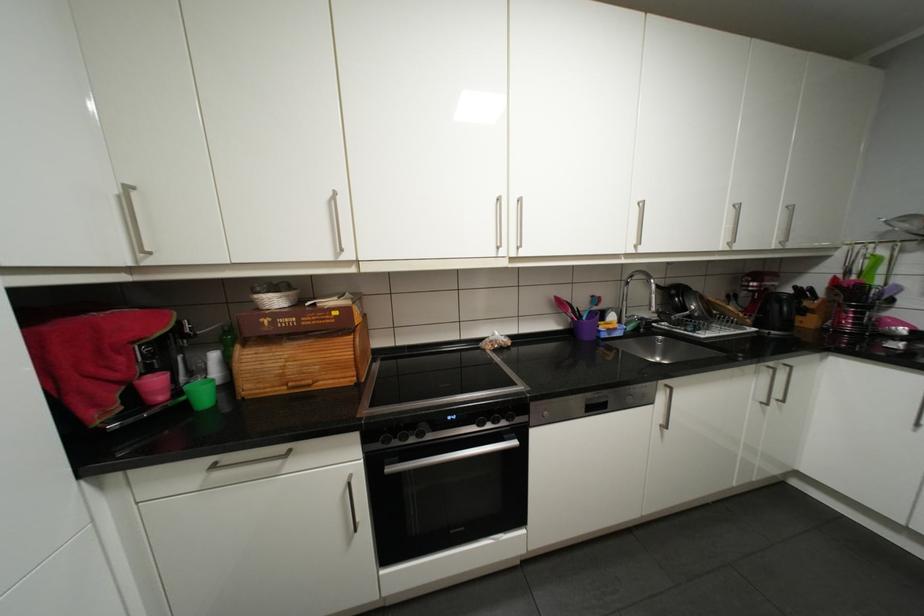
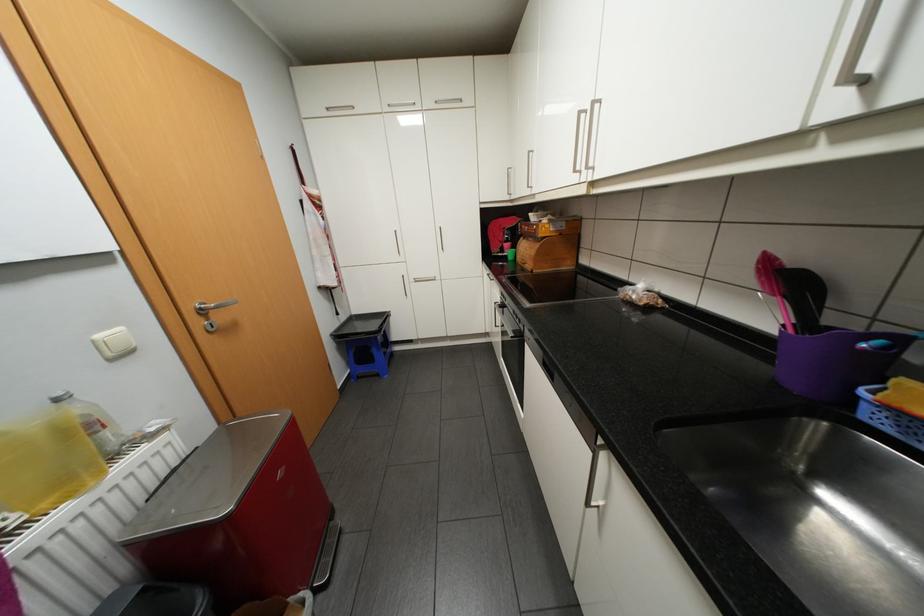
Locate, in the second image, the point that corresponds to the point at 251,344 in the first image.

(531, 237)